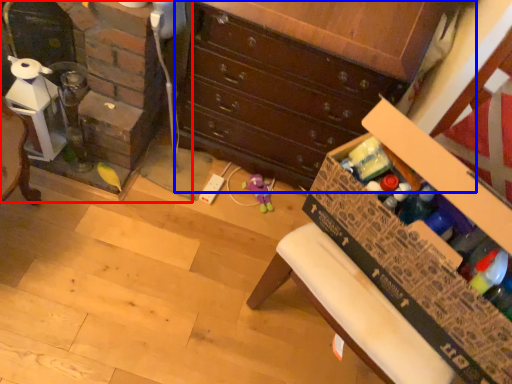
Question: Which object appears farthest to the camera in this image, fireplace (highlighted by a red box) or chest of drawers (highlighted by a blue box)?

Choices:
 (A) fireplace
 (B) chest of drawers

Answer: (A)